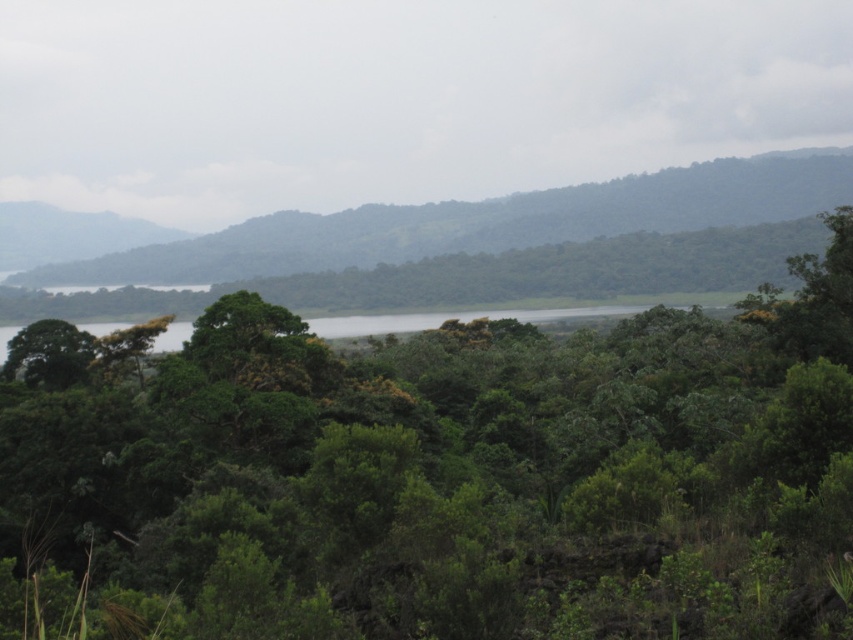
Which is above, green leafy tree at center or green leafy hillside at center?

Positioned higher is green leafy hillside at center.

Which is more to the left, green leafy tree at center or green leafy hillside at center?

green leafy tree at center

Describe the element at coordinates (438, 476) in the screenshot. This screenshot has height=640, width=853. I see `green leafy tree at center` at that location.

Image resolution: width=853 pixels, height=640 pixels. What are the coordinates of `green leafy tree at center` in the screenshot? It's located at (438, 476).

Which is above, green leafy hillside at center or green water at center?

green leafy hillside at center is higher up.

Who is more distant from viewer, (757,202) or (167,349)?

The point (757,202) is behind.

Locate an element on the screen. This screenshot has height=640, width=853. green leafy hillside at center is located at coordinates 480,224.

I want to click on green leafy hillside at center, so click(x=480, y=224).

Is green leafy tree at center below green water at center?

Indeed, green leafy tree at center is positioned under green water at center.

Is green leafy tree at center shorter than green water at center?

No.

Which is in front, point (283, 444) or point (322, 317)?

Positioned in front is point (283, 444).

Find the location of `green leafy tree at center`. green leafy tree at center is located at coordinates (438, 476).